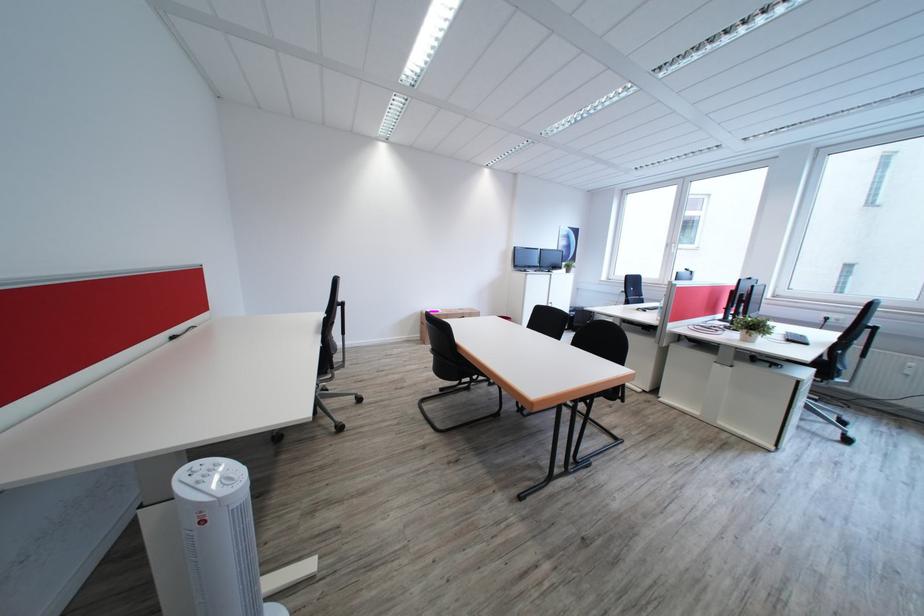
Where is `white fan dial`? The width and height of the screenshot is (924, 616). white fan dial is located at coordinates (x=214, y=476).